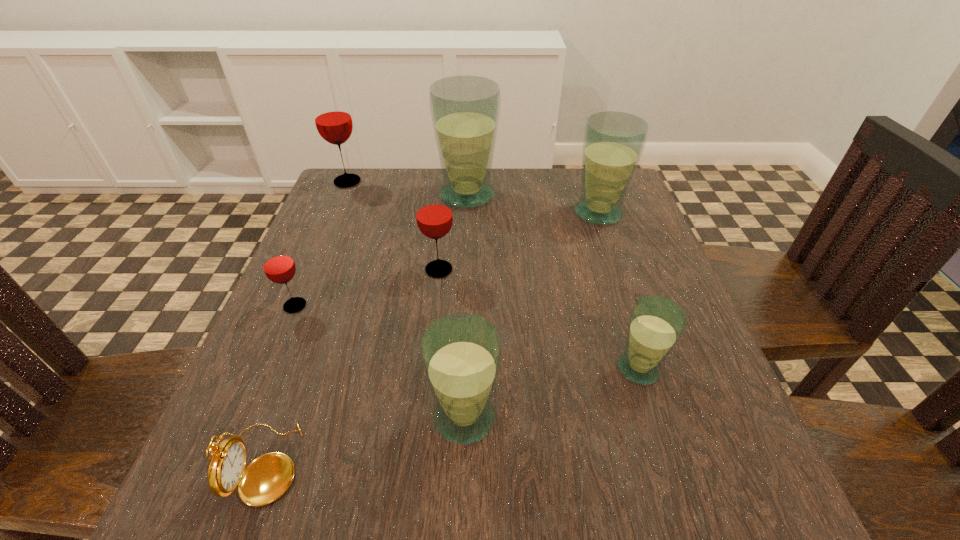
Where is `the tallest glass`? the tallest glass is located at coordinates (465, 110).

Identify the location of the biggest blue glass. (465, 110).

You are a GUI agent. You are given a task and a screenshot of the screen. Output one action in this format:
    pyautogui.click(x=<x>, y=<y>)
    Task: Click on the farthest red glass
    The image size is (960, 540).
    Given the screenshot: What is the action you would take?
    pyautogui.click(x=332, y=116)

At what (x,y) coordinates should I click in order to perform the action: click on the second biggest blue glass. Please return your answer as a coordinate pair (x, y). The image size is (960, 540). Looking at the image, I should click on (613, 142).

Where is `the second smallest red glass`? This screenshot has height=540, width=960. the second smallest red glass is located at coordinates (434, 217).

Identify the location of the fourth farthest object. (434, 217).

What are the coordinates of `the third biggest blue glass` in the screenshot? It's located at (461, 353).

Identify the location of the fifth farthest glass. (278, 265).

Identify the location of the nearest red glass. The image size is (960, 540). (278, 265).

Image resolution: width=960 pixels, height=540 pixels. Identify the location of the smallest blue glass. (x=656, y=323).